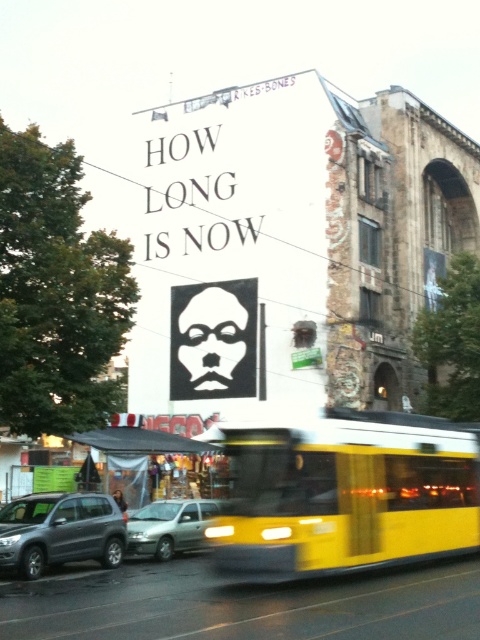
Question: Which point appears farthest from the camera in this image?

Choices:
 (A) (111, 547)
 (B) (339, 513)
 (C) (153, 516)

Answer: (C)

Question: Is matte gray suv at left in front of silver metallic hatchback at center?

Choices:
 (A) no
 (B) yes

Answer: (B)

Question: Is yellow matte bus at center thinner than matte gray suv at left?

Choices:
 (A) yes
 (B) no

Answer: (B)

Question: Can you confirm if matte gray suv at left is bigger than silver metallic hatchback at center?

Choices:
 (A) yes
 (B) no

Answer: (B)

Question: Which point is closer to the camera?

Choices:
 (A) (50, 506)
 (B) (192, 548)
 (C) (302, 460)

Answer: (C)

Question: Which point is farther to the camera?

Choices:
 (A) matte gray suv at left
 (B) yellow matte bus at center
 (C) silver metallic hatchback at center

Answer: (C)